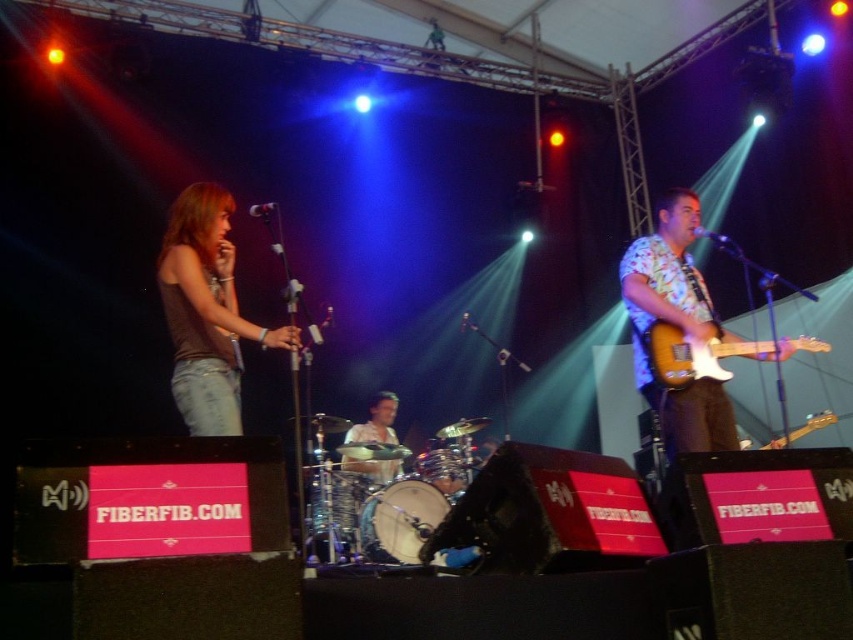
You are a stagehand preparing to adjust the height of the microphone stand for the performer wearing brown denim jeans at left and holding the wooden electric guitar at right. Based on their positions, which object requires a taller microphone stand adjustment?

The brown denim jeans at left requires a taller microphone stand adjustment because the brown denim jeans at left is much taller than the wooden electric guitar at right.